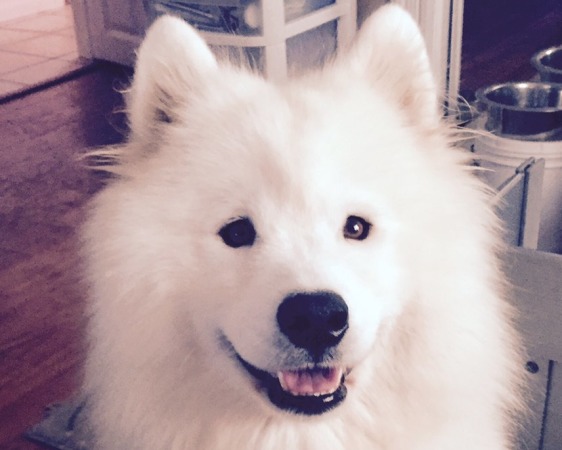
Where is `floor`? floor is located at coordinates (39, 309).